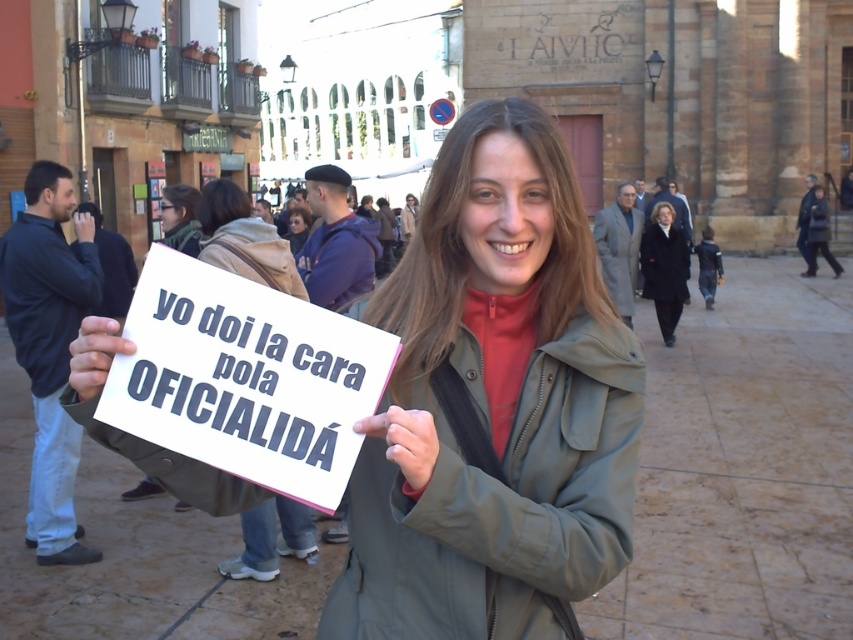
Does dark blue coat at upper right have a lesser height compared to dark brown hair at center?

Indeed, dark blue coat at upper right has a lesser height compared to dark brown hair at center.

Which of these two, dark blue coat at upper right or dark brown hair at center, stands taller?

dark brown hair at center is taller.

What do you see at coordinates (664, 268) in the screenshot? The width and height of the screenshot is (853, 640). I see `dark blue coat at upper right` at bounding box center [664, 268].

This screenshot has width=853, height=640. Find the location of `dark blue coat at upper right`. dark blue coat at upper right is located at coordinates (664, 268).

Describe the element at coordinates (492, 404) in the screenshot. I see `matte green jacket at center` at that location.

Based on the photo, does matte green jacket at center have a lesser height compared to white paper sign at center?

No, matte green jacket at center is not shorter than white paper sign at center.

Does point (386, 636) lie behind point (225, 227)?

No, it is in front of (225, 227).

Where is `matte green jacket at center`? Image resolution: width=853 pixels, height=640 pixels. matte green jacket at center is located at coordinates (492, 404).

Who is more distant from viewer, (404, 321) or (302, 237)?

The point (302, 237) is more distant.

Does matte green jacket at center appear under dark brown hair at center?

Yes, matte green jacket at center is below dark brown hair at center.

This screenshot has height=640, width=853. What do you see at coordinates (492, 404) in the screenshot? I see `matte green jacket at center` at bounding box center [492, 404].

You are a GUI agent. You are given a task and a screenshot of the screen. Output one action in this format:
    pyautogui.click(x=<x>, y=<y>)
    Task: Click on the matte green jacket at center
    
    Given the screenshot: What is the action you would take?
    pyautogui.click(x=492, y=404)